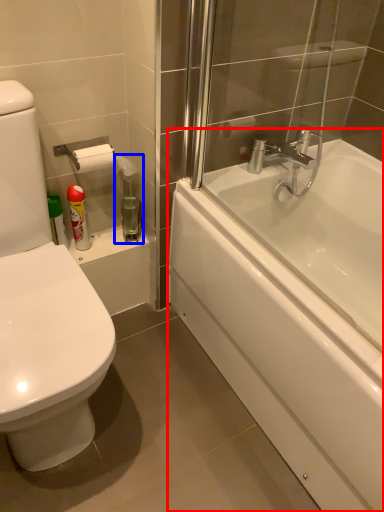
Question: Which object appears farthest to the camera in this image, bathtub (highlighted by a red box) or cleaning product (highlighted by a blue box)?

Choices:
 (A) bathtub
 (B) cleaning product

Answer: (B)